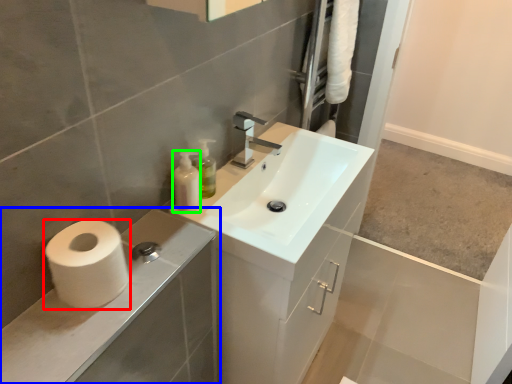
Question: Based on their relative distances, which object is nearer to toilet paper (highlighted by a red box)? Choose from bathroom cabinet (highlighted by a blue box) and toiletry (highlighted by a green box).

Choices:
 (A) bathroom cabinet
 (B) toiletry

Answer: (A)